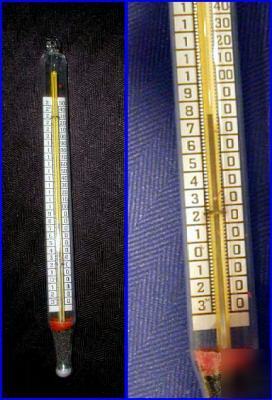
You are a GUI agent. You are given a task and a screenshot of the screen. Output one action in this format:
    pyautogui.click(x=<x>, y=<y>)
    Task: Click on the thermometer
    This screenshot has width=272, height=400.
    Given the screenshot: What is the action you would take?
    pyautogui.click(x=194, y=331)